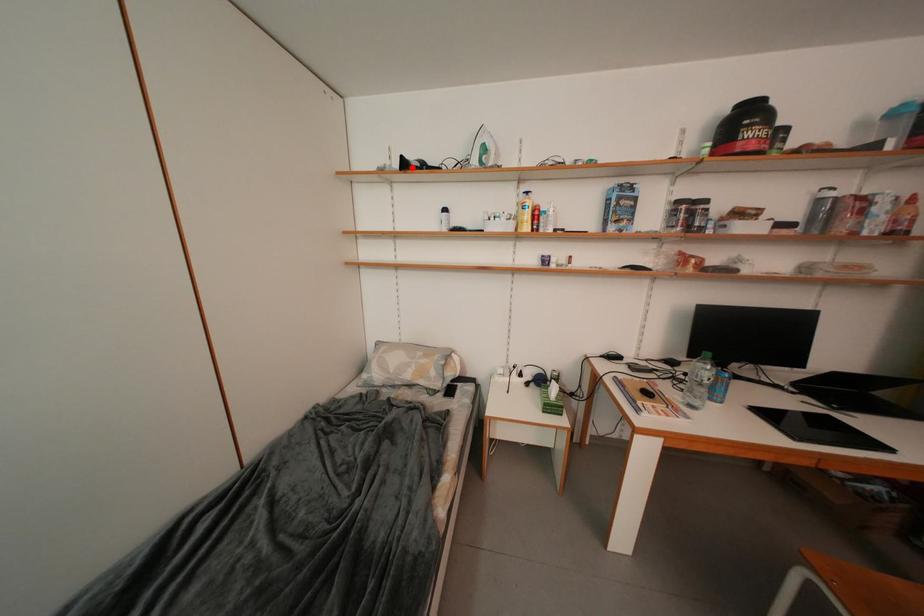
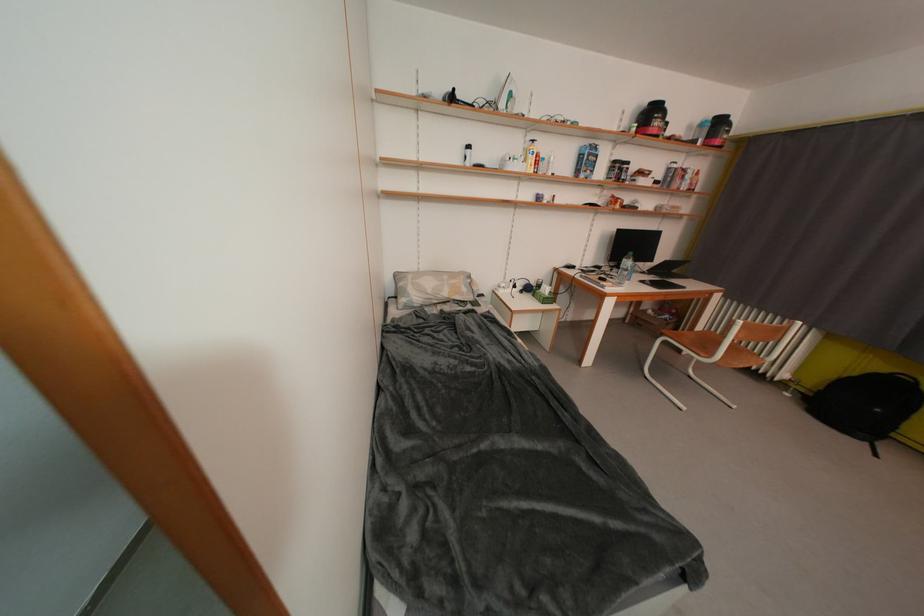
In the second image, find the point that corresponds to the highlighted location in the first image.

(459, 100)